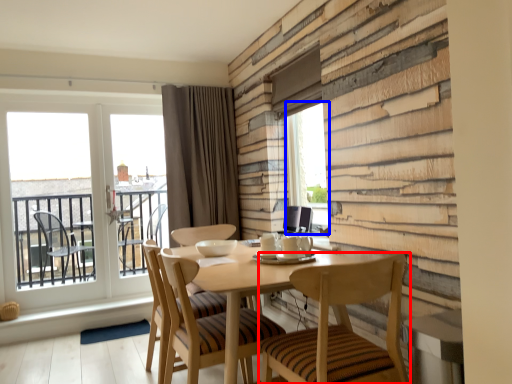
Question: Among these objects, which one is nearest to the camera, chair (highlighted by a red box) or window screen (highlighted by a blue box)?

Choices:
 (A) chair
 (B) window screen

Answer: (A)